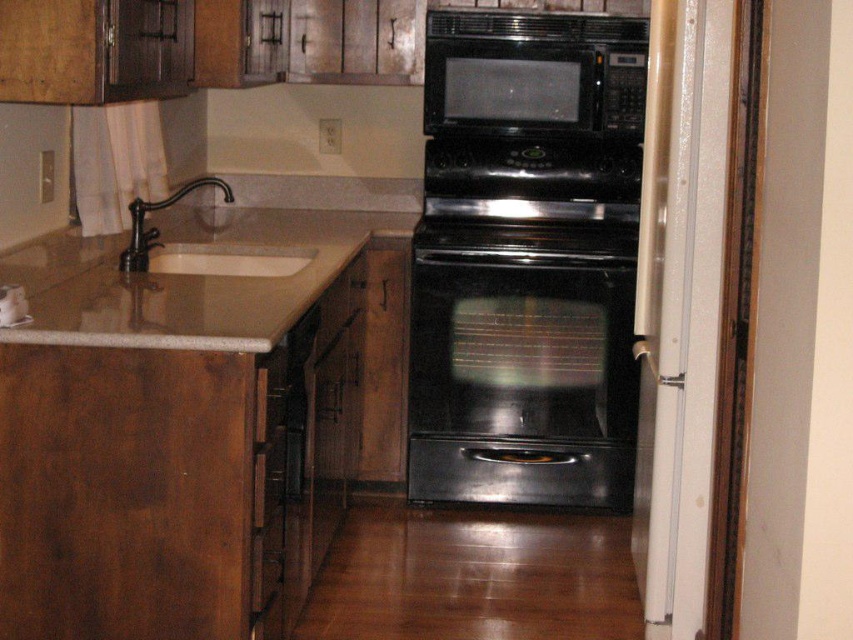
Question: Does black matte microwave at upper center have a greater width compared to white glossy sink at left?

Choices:
 (A) yes
 (B) no

Answer: (A)

Question: Is brown granite sink at left below white glossy sink at left?

Choices:
 (A) yes
 (B) no

Answer: (A)

Question: Estimate the real-world distances between objects in this image. Which object is farther from the black matte microwave at upper center?

Choices:
 (A) black glossy oven at center
 (B) brown granite sink at left
 (C) white glossy sink at left

Answer: (C)

Question: Is black glossy oven at center positioned before white glossy sink at left?

Choices:
 (A) yes
 (B) no

Answer: (B)

Question: Which point is closer to the camera?

Choices:
 (A) (531, 394)
 (B) (170, 324)
 (C) (566, 129)
 (D) (144, 253)

Answer: (B)

Question: Which point is closer to the camera?

Choices:
 (A) (132, 253)
 (B) (90, 259)

Answer: (A)